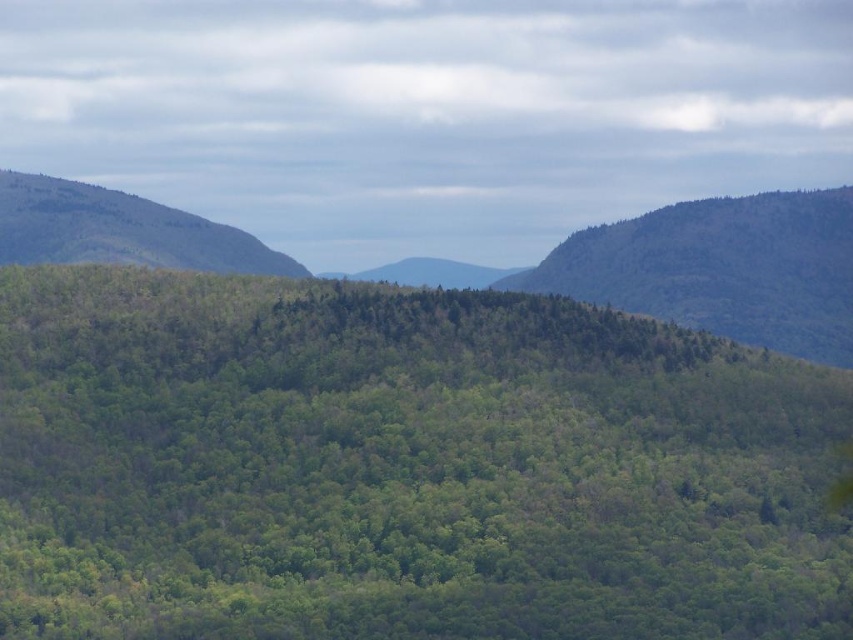
Based on the scene, which object is larger in size between the green forested mountain at center and the green leafy hill at right?

The green forested mountain at center is bigger than the green leafy hill at right according to the description.